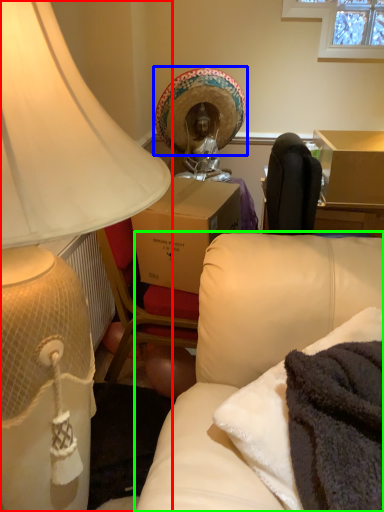
Question: Estimate the real-world distances between objects in this image. Which object is farther from lamp (highlighted by a red box), headdress (highlighted by a blue box) or studio couch (highlighted by a green box)?

Choices:
 (A) headdress
 (B) studio couch

Answer: (A)